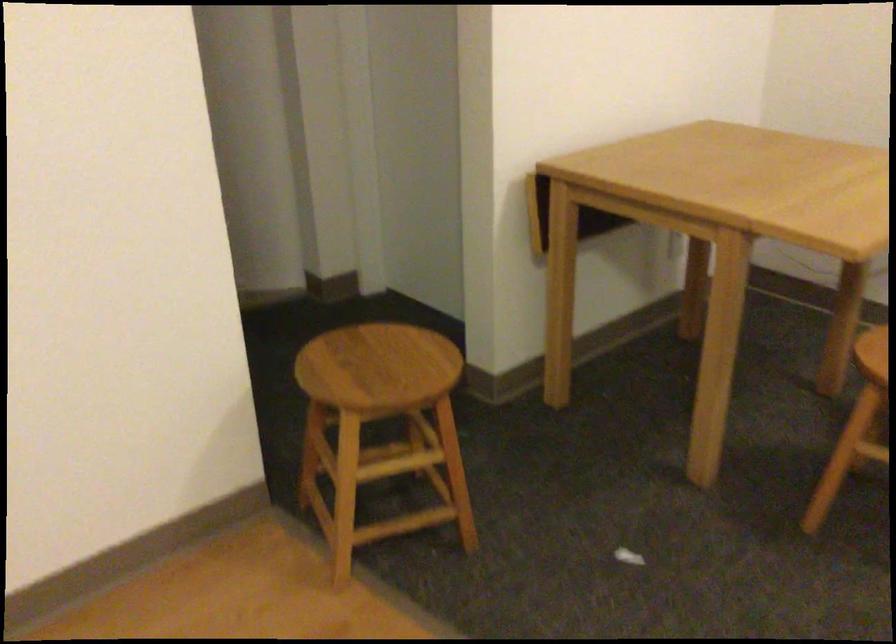
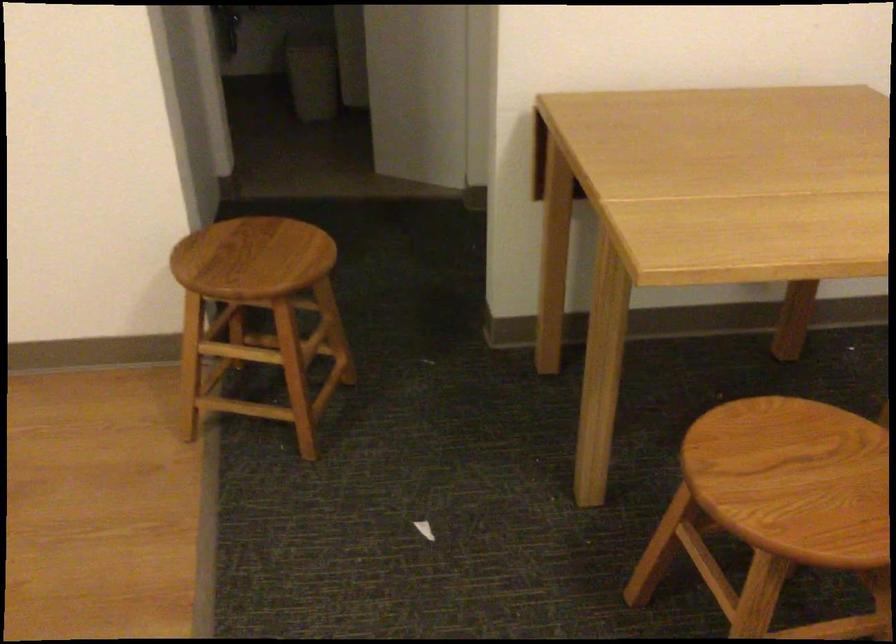
Locate, in the second image, the point that corresponds to the point at 624,558 in the first image.

(424, 529)